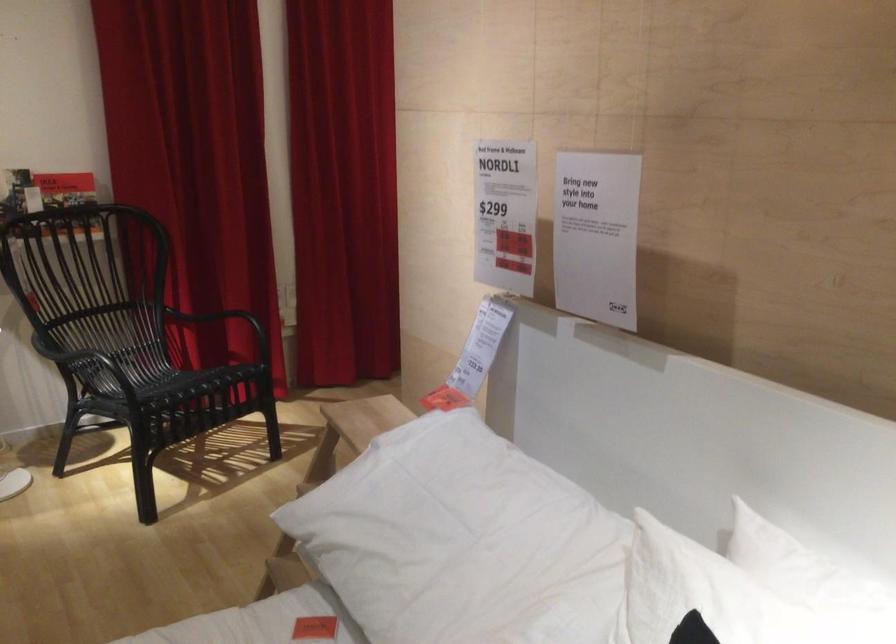
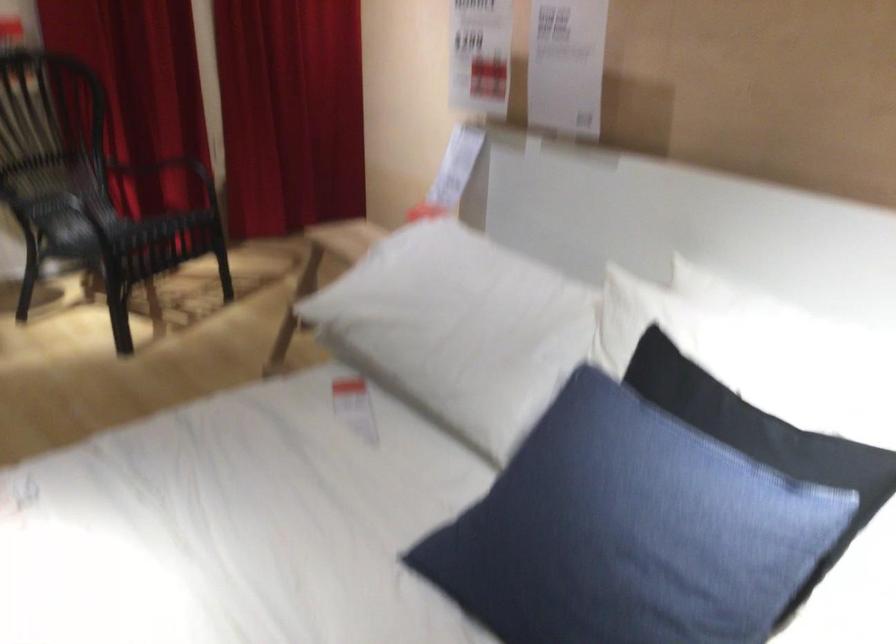
Locate, in the second image, the point that corresponds to [444,558] in the first image.

(455, 321)